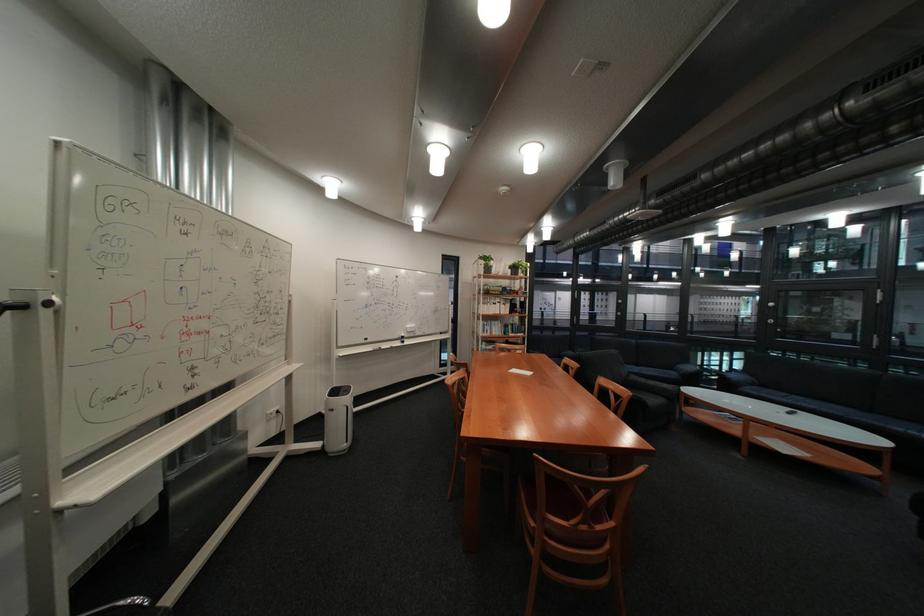
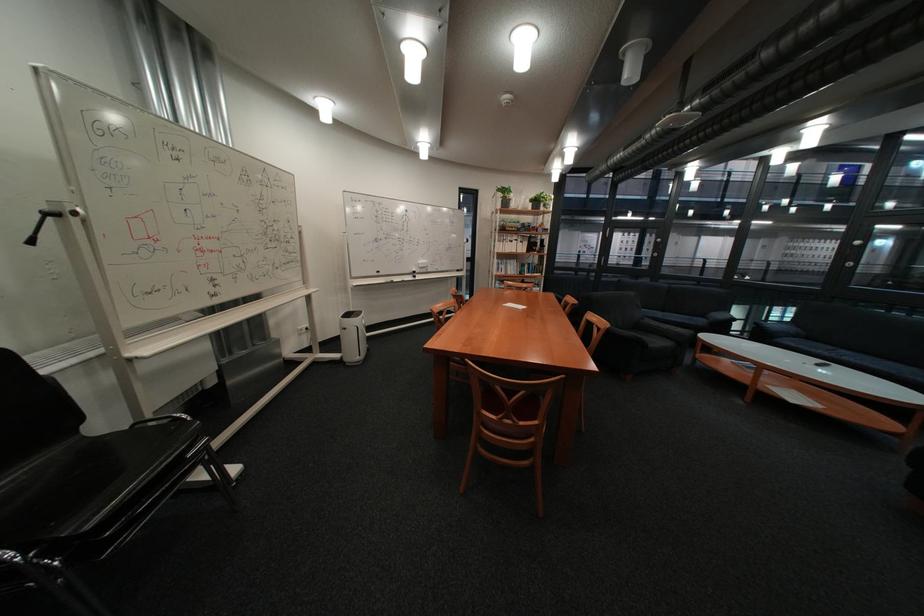
Locate, in the second image, the point that corresponds to pixel 772 392 in the first image.

(808, 345)